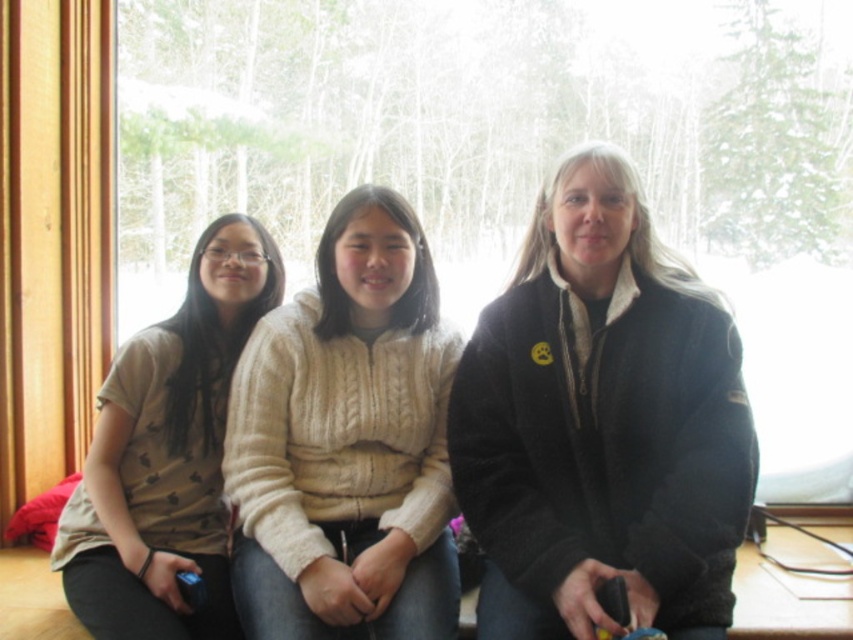
Does black fuzzy jacket at center have a larger size compared to matte beige sweater at left?

Yes.

Is black fuzzy jacket at center above matte beige sweater at left?

Indeed, black fuzzy jacket at center is positioned over matte beige sweater at left.

The image size is (853, 640). In order to click on black fuzzy jacket at center in this screenshot , I will do `click(601, 424)`.

Can you confirm if creamy knit sweater at center is positioned to the right of matte beige sweater at left?

Indeed, creamy knit sweater at center is positioned on the right side of matte beige sweater at left.

Which is behind, point (334, 387) or point (102, 429)?

Point (102, 429)

You are a GUI agent. You are given a task and a screenshot of the screen. Output one action in this format:
    pyautogui.click(x=<x>, y=<y>)
    Task: Click on the creamy knit sweater at center
    
    Given the screenshot: What is the action you would take?
    pyautogui.click(x=347, y=444)

Who is taller, transparent glass window at center or creamy knit sweater at center?

transparent glass window at center

Does transparent glass window at center have a greater height compared to creamy knit sweater at center?

Yes.

Who is more distant from viewer, (248,164) or (345,608)?

Point (248,164)

Identify the location of transparent glass window at center. (519, 156).